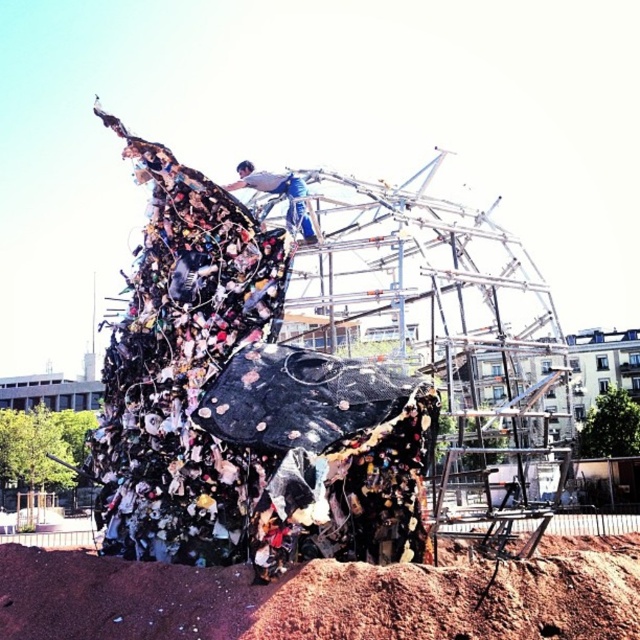
Is brown dirt mound at lower center shorter than white fabric at upper center?

Yes.

Which is more to the left, brown dirt mound at lower center or white fabric at upper center?

Positioned to the left is white fabric at upper center.

Where is `brown dirt mound at lower center`? Image resolution: width=640 pixels, height=640 pixels. brown dirt mound at lower center is located at coordinates (324, 598).